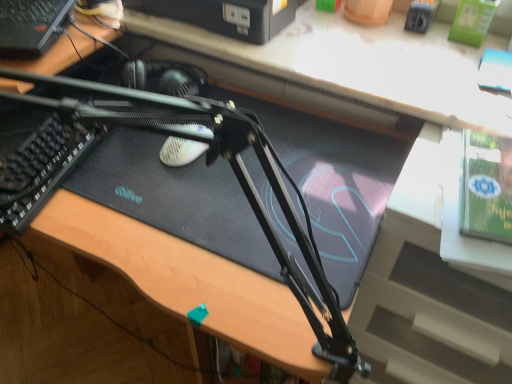
Where is `green matte paperback book at upper right`? The image size is (512, 384). green matte paperback book at upper right is located at coordinates (486, 187).

Find the location of `black plastic computer at upper left, arranged as the second computer when viewed from the right`. black plastic computer at upper left, arranged as the second computer when viewed from the right is located at coordinates (31, 26).

Who is taller, black textured keyboard at left or green matte paperback book at upper right?

With more height is black textured keyboard at left.

Considering the relative sizes of black textured keyboard at left and green matte paperback book at upper right in the image provided, is black textured keyboard at left wider than green matte paperback book at upper right?

Correct, the width of black textured keyboard at left exceeds that of green matte paperback book at upper right.

Considering the positions of objects black textured keyboard at left and green matte paperback book at upper right in the image provided, who is more to the right, black textured keyboard at left or green matte paperback book at upper right?

green matte paperback book at upper right is more to the right.

Where is `paperback book above the black textured keyboard at left (from a real-world perspective)`? This screenshot has width=512, height=384. paperback book above the black textured keyboard at left (from a real-world perspective) is located at coordinates (486, 187).

From a real-world perspective, who is located lower, black matte computer desk at center or black textured keyboard at left?

black textured keyboard at left is physically lower.

Would you say black matte computer desk at center is to the left or to the right of black textured keyboard at left in the picture?

Based on their positions, black matte computer desk at center is located to the right of black textured keyboard at left.

Which of these two, black matte computer desk at center or black textured keyboard at left, is wider?

With larger width is black matte computer desk at center.

Does black matte computer desk at center turn towards black textured keyboard at left?

No, black matte computer desk at center is not oriented towards black textured keyboard at left.

Is black plastic printer at upper center, the first computer positioned from the right, in contact with black matte computer desk at center?

There is a gap between black plastic printer at upper center, the first computer positioned from the right, and black matte computer desk at center.

Does point (202, 17) come farther from viewer compared to point (454, 56)?

Yes, it is.

Is black plastic printer at upper center, the first computer positioned from the right, aimed at black matte computer desk at center?

No, black plastic printer at upper center, the first computer positioned from the right, is not aimed at black matte computer desk at center.

Relative to black matte computer desk at center, is black plastic printer at upper center, acting as the 2th computer starting from the left, in front or behind?

black plastic printer at upper center, acting as the 2th computer starting from the left, is behind black matte computer desk at center.

Can you confirm if black textured keyboard at left is smaller than black plastic printer at upper center, acting as the 2th computer starting from the left?

Indeed, black textured keyboard at left has a smaller size compared to black plastic printer at upper center, acting as the 2th computer starting from the left.

Which is closer, (0, 147) or (236, 35)?

Point (0, 147) is positioned closer to the camera compared to point (236, 35).

Based on the photo, in the image, is black textured keyboard at left on the left side or the right side of black plastic printer at upper center, the first computer positioned from the right?

In the image, black textured keyboard at left appears on the left side of black plastic printer at upper center, the first computer positioned from the right.

Considering their positions, is black textured keyboard at left located in front of or behind black plastic printer at upper center, acting as the 2th computer starting from the left?

Clearly, black textured keyboard at left is in front of black plastic printer at upper center, acting as the 2th computer starting from the left.

Where is `the 1st computer behind the black textured keyboard at left, counting from the anchor's position`? the 1st computer behind the black textured keyboard at left, counting from the anchor's position is located at coordinates (31, 26).

Which is in front, black textured keyboard at left or black plastic computer at upper left, the 1th computer in the left-to-right sequence?

black textured keyboard at left is more forward.

Is point (10, 133) less distant than point (8, 45)?

That is True.

Is black textured keyboard at left outside of black plastic computer at upper left, the 1th computer in the left-to-right sequence?

That's correct, black textured keyboard at left is outside of black plastic computer at upper left, the 1th computer in the left-to-right sequence.

Looking at this image, how different are the orientations of green matte paperback book at upper right and black textured keyboard at left in degrees?

green matte paperback book at upper right and black textured keyboard at left are facing 1.85 degrees away from each other.

Is green matte paperback book at upper right taller than black textured keyboard at left?

In fact, green matte paperback book at upper right may be shorter than black textured keyboard at left.

Looking at the image, does green matte paperback book at upper right seem bigger or smaller compared to black textured keyboard at left?

In the image, green matte paperback book at upper right appears to be smaller than black textured keyboard at left.

From the image's perspective, between green matte paperback book at upper right and black textured keyboard at left, which one is located above?

black textured keyboard at left, from the image's perspective.

Where is `computer desk that appears above the green matte paperback book at upper right (from the image's perspective)`? computer desk that appears above the green matte paperback book at upper right (from the image's perspective) is located at coordinates (360, 64).

Is black matte computer desk at center smaller than green matte paperback book at upper right?

No, black matte computer desk at center is not smaller than green matte paperback book at upper right.

Would you say black matte computer desk at center is to the left or to the right of green matte paperback book at upper right in the picture?

From the image, it's evident that black matte computer desk at center is to the left of green matte paperback book at upper right.

Is black matte computer desk at center positioned far away from green matte paperback book at upper right?

They are positioned close to each other.

I want to click on paperback book on the right of black textured keyboard at left, so click(486, 187).

You are a GUI agent. You are given a task and a screenshot of the screen. Output one action in this format:
    pyautogui.click(x=<x>, y=<y>)
    Task: Click on the laptop keyboard on the left of the black matte computer desk at center
    
    Given the screenshot: What is the action you would take?
    pyautogui.click(x=38, y=167)

Looking at the image, which one is located closer to black textured keyboard at left, black plastic computer at upper left, the 1th computer in the left-to-right sequence, or black matte computer desk at center?

black plastic computer at upper left, the 1th computer in the left-to-right sequence, is positioned closer to the anchor black textured keyboard at left.

Based on their spatial positions, is black matte computer desk at center or green matte paperback book at upper right closer to black textured keyboard at left?

Based on the image, black matte computer desk at center appears to be nearer to black textured keyboard at left.

Based on their spatial positions, is black textured keyboard at left or black matte computer desk at center closer to black plastic printer at upper center, acting as the 2th computer starting from the left?

black matte computer desk at center is closer to black plastic printer at upper center, acting as the 2th computer starting from the left.

Estimate the real-world distances between objects in this image. Which object is closer to black plastic printer at upper center, the first computer positioned from the right, black plastic computer at upper left, the 1th computer in the left-to-right sequence, or green matte paperback book at upper right?

black plastic computer at upper left, the 1th computer in the left-to-right sequence.

Based on the photo, which object lies nearer to the anchor point black plastic computer at upper left, the 1th computer in the left-to-right sequence, green matte paperback book at upper right or black textured keyboard at left?

The object closer to black plastic computer at upper left, the 1th computer in the left-to-right sequence, is black textured keyboard at left.

In the scene shown: Which object lies nearer to the anchor point black plastic printer at upper center, the first computer positioned from the right, black matte computer desk at center or green matte paperback book at upper right?

The object closer to black plastic printer at upper center, the first computer positioned from the right, is black matte computer desk at center.

When comparing their distances from green matte paperback book at upper right, does black textured keyboard at left or black plastic printer at upper center, the first computer positioned from the right, seem closer?

black plastic printer at upper center, the first computer positioned from the right, is closer to green matte paperback book at upper right.

Estimate the real-world distances between objects in this image. Which object is closer to black plastic printer at upper center, the first computer positioned from the right, black matte computer desk at center or black plastic computer at upper left, arranged as the second computer when viewed from the right?

black matte computer desk at center is closer to black plastic printer at upper center, the first computer positioned from the right.

This screenshot has width=512, height=384. Find the location of `computer between black textured keyboard at left and green matte paperback book at upper right in the horizontal direction`. computer between black textured keyboard at left and green matte paperback book at upper right in the horizontal direction is located at coordinates (226, 15).

What are the coordinates of `computer between black plastic printer at upper center, acting as the 2th computer starting from the left, and black textured keyboard at left vertically` in the screenshot? It's located at (31, 26).

Locate an element on the screen. The width and height of the screenshot is (512, 384). computer situated between black plastic computer at upper left, arranged as the second computer when viewed from the right, and green matte paperback book at upper right from left to right is located at coordinates (226, 15).

At what (x,y) coordinates should I click in order to perform the action: click on computer desk between black textured keyboard at left and green matte paperback book at upper right from left to right. Please return your answer as a coordinate pair (x, y). This screenshot has width=512, height=384. Looking at the image, I should click on (360, 64).